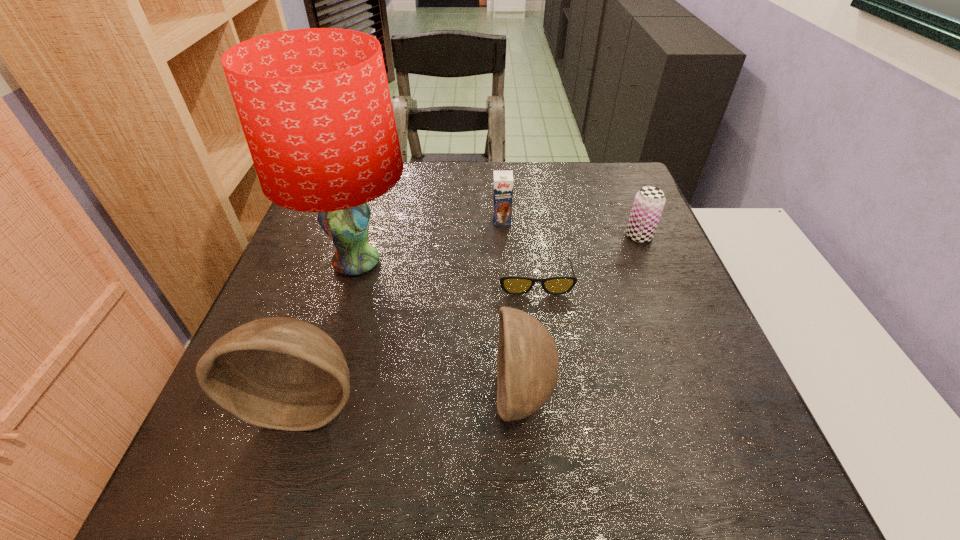
You are a GUI agent. You are given a task and a screenshot of the screen. Output one action in this format:
    pyautogui.click(x=<x>, y=<y>)
    Task: Click on the free space at the left edge of the desktop
    The image size is (960, 540).
    Given the screenshot: What is the action you would take?
    pyautogui.click(x=330, y=240)

Where is `free location at the right edge`? The height and width of the screenshot is (540, 960). free location at the right edge is located at coordinates (648, 292).

The height and width of the screenshot is (540, 960). I want to click on free space that is in between the sunglasses and the rightmost object, so click(587, 258).

Find the location of `vacant area that lies between the taller bowl and the shortest object`. vacant area that lies between the taller bowl and the shortest object is located at coordinates (420, 341).

Find the location of a particular element. vacant space that is in between the shortest object and the rightmost object is located at coordinates (587, 258).

Locate an element on the screen. The width and height of the screenshot is (960, 540). vacant area that lies between the third tallest object and the chocolate milk is located at coordinates (512, 307).

Image resolution: width=960 pixels, height=540 pixels. In order to click on free spot between the farthest object and the tallest object in this screenshot , I will do `click(429, 241)`.

The image size is (960, 540). In order to click on free space between the beer can and the sunglasses in this screenshot , I will do `click(587, 258)`.

Locate an element on the screen. free spot between the farthest object and the tallest object is located at coordinates (429, 241).

Locate an element on the screen. free spot between the tallest object and the shorter bowl is located at coordinates (440, 329).